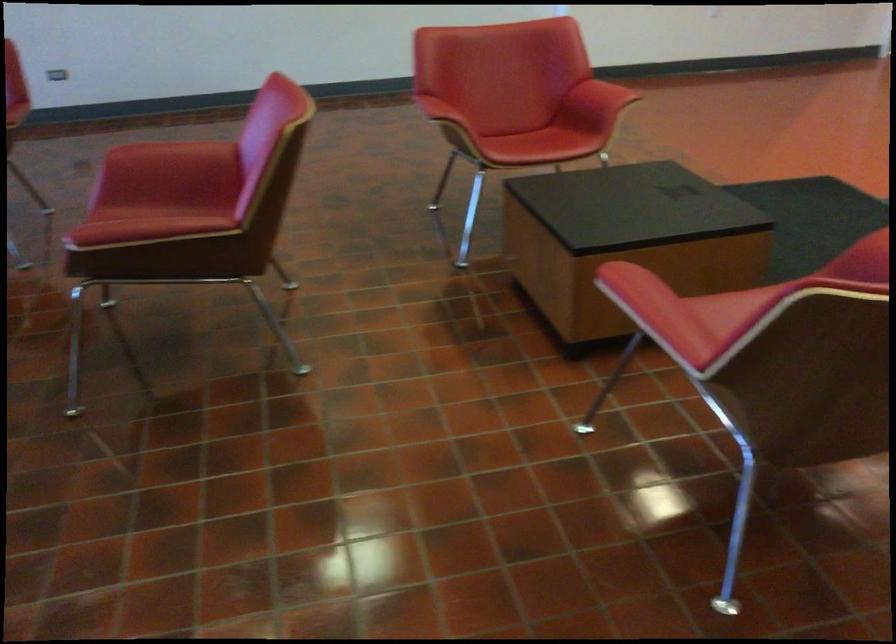
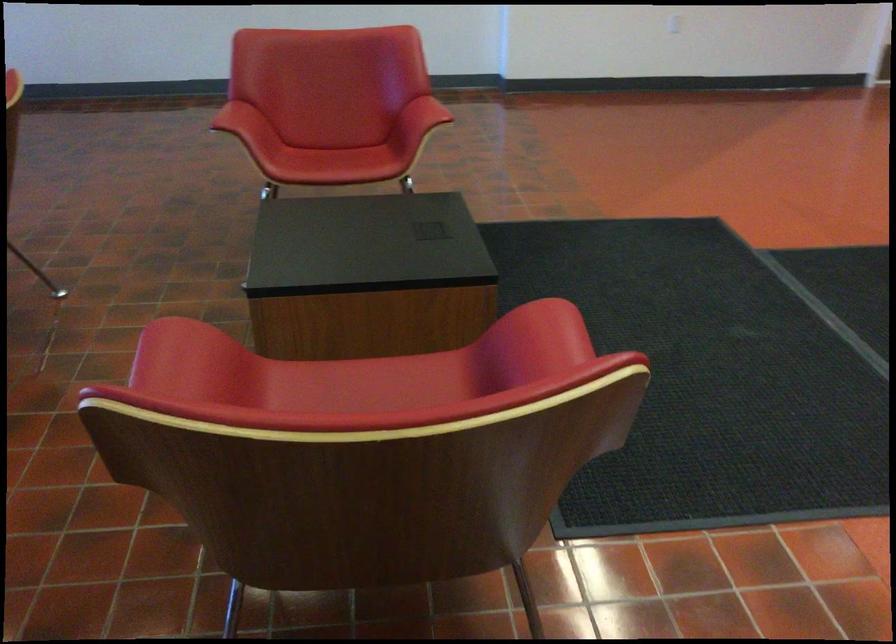
Question: What movement of the cameraman would produce the second image?

Choices:
 (A) Left
 (B) Right
 (C) Forward
 (D) Backward

Answer: (B)